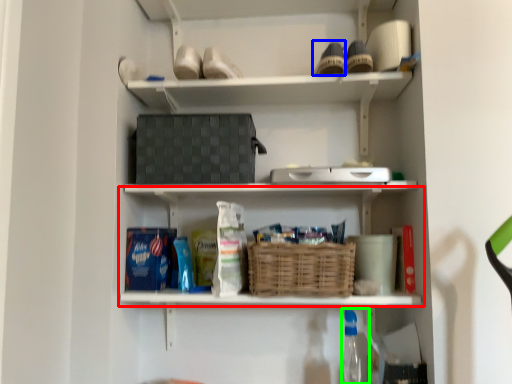
Question: Which object is the closest to the shelf (highlighted by a red box)? Choose among these: shoe (highlighted by a blue box) or bottle (highlighted by a green box).

Choices:
 (A) shoe
 (B) bottle

Answer: (B)